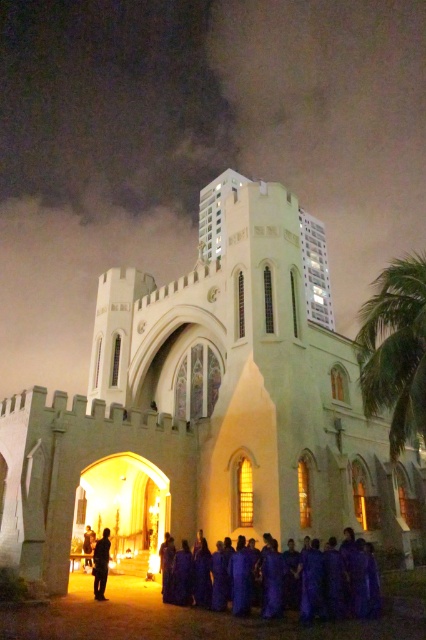
Question: Observing the image, what is the correct spatial positioning of white stone church at center in reference to purple fabric person at center?

Choices:
 (A) above
 (B) below

Answer: (A)

Question: Which object is farther from the camera taking this photo?

Choices:
 (A) green leafy palm tree at right
 (B) purple matte dress at center
 (C) white stone church at center
 (D) purple fabric person at center

Answer: (D)

Question: From the image, what is the correct spatial relationship of purple matte dress at center in relation to green leafy palm tree at right?

Choices:
 (A) above
 (B) below

Answer: (B)

Question: Which object is the closest to the purple fabric at center?

Choices:
 (A) green leafy palm tree at right
 (B) purple fabric person at center
 (C) white stone church at center
 (D) purple matte dress at center

Answer: (B)

Question: Estimate the real-world distances between objects in this image. Which object is farther from the purple fabric at center?

Choices:
 (A) purple fabric person at center
 (B) green leafy palm tree at right
 (C) white stone church at center
 (D) purple matte dress at center

Answer: (C)

Question: Can you confirm if green leafy palm tree at right is positioned to the left of purple fabric at center?

Choices:
 (A) no
 (B) yes

Answer: (A)